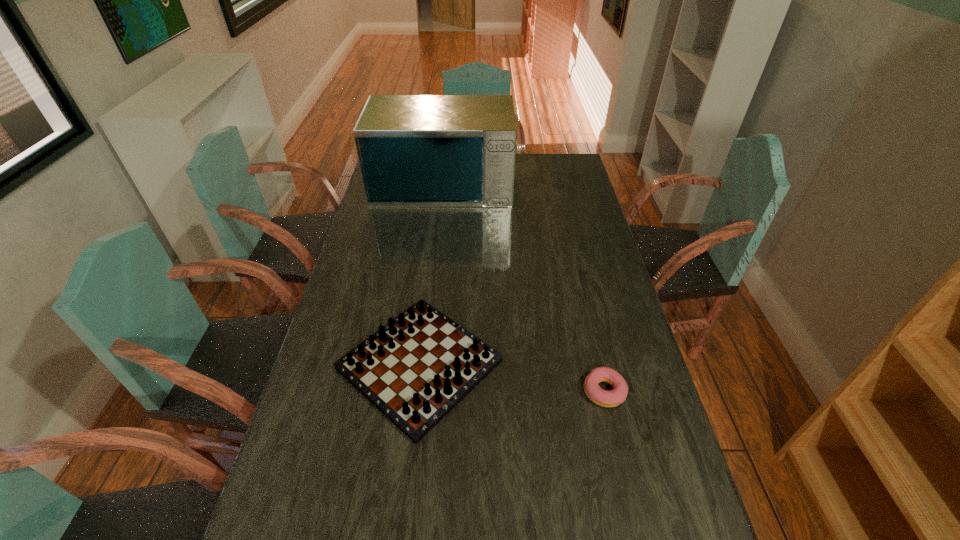
Locate an element on the screen. empty space that is in between the second shortest object and the tallest object is located at coordinates (432, 272).

Where is `empty space between the microwave oven and the chessboard`? empty space between the microwave oven and the chessboard is located at coordinates (432, 272).

Where is `vacant space in between the microwave oven and the chessboard`? The image size is (960, 540). vacant space in between the microwave oven and the chessboard is located at coordinates (432, 272).

This screenshot has height=540, width=960. I want to click on object that stands as the second closest to the microwave oven, so click(x=604, y=398).

Select which object appears as the closest to the chessboard. Please provide its 2D coordinates. Your answer should be formatted as a tuple, i.e. [(x, y)], where the tuple contains the x and y coordinates of a point satisfying the conditions above.

[(604, 398)]

The height and width of the screenshot is (540, 960). Identify the location of vacant space that satisfies the following two spatial constraints: 1. on the front-facing side of the rightmost object; 2. on the left side of the microwave oven. [420, 391].

At what (x,y) coordinates should I click in order to perform the action: click on free point that satisfies the following two spatial constraints: 1. on the front-facing side of the farthest object; 2. on the right side of the shortest object. Please return your answer as a coordinate pair (x, y). Looking at the image, I should click on (420, 391).

Locate an element on the screen. The image size is (960, 540). vacant region that satisfies the following two spatial constraints: 1. on the front-facing side of the tallest object; 2. on the left side of the rightmost object is located at coordinates (420, 391).